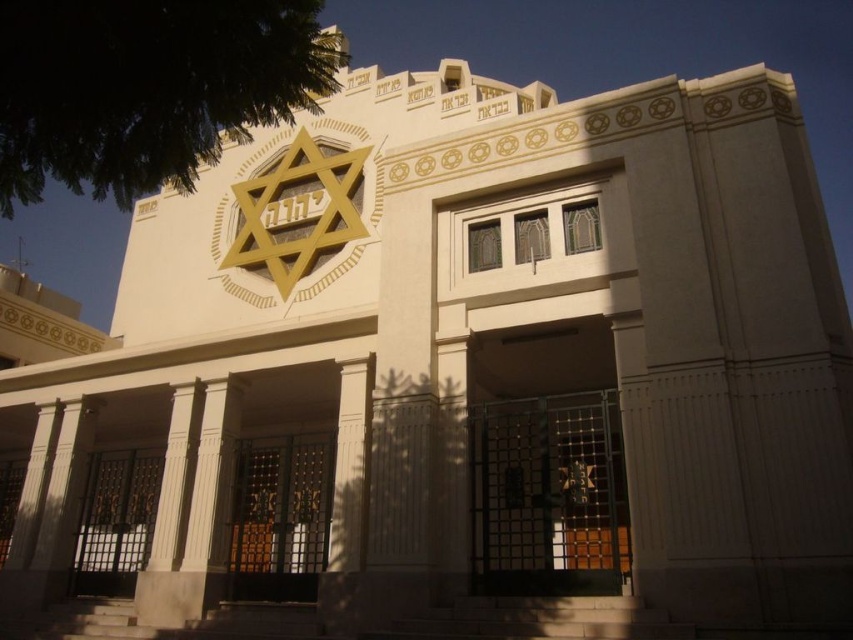
Is metallic gate at center positioned in front of wooden gate at center?

Yes.

Who is more distant from viewer, (613,550) or (308,449)?

The point (308,449) is more distant.

Is point (576, 467) less distant than point (294, 563)?

Yes, point (576, 467) is closer to viewer.

What are the coordinates of `metallic gate at center` in the screenshot? It's located at (548, 497).